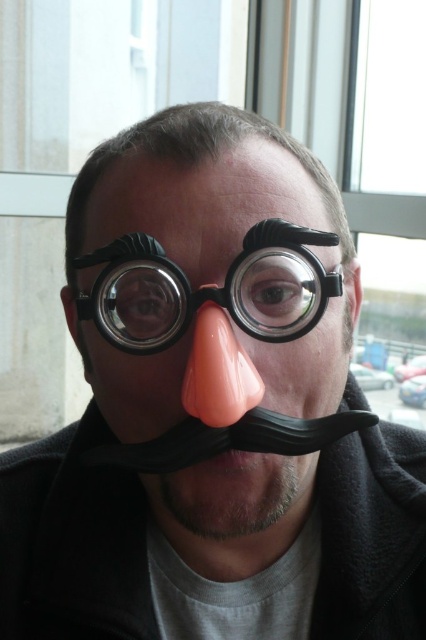
Does rubber/matte clown nose at center appear over black rubber mustache at lower center?

Indeed, rubber/matte clown nose at center is positioned over black rubber mustache at lower center.

Describe the element at coordinates (218, 371) in the screenshot. I see `rubber/matte clown nose at center` at that location.

Does point (247, 141) come behind point (198, 460)?

Yes, point (247, 141) is behind point (198, 460).

The height and width of the screenshot is (640, 426). I want to click on rubber/matte clown nose at center, so click(x=218, y=371).

Is pink rubber nose at center bigger than black rubber mustache at lower center?

Correct, pink rubber nose at center is larger in size than black rubber mustache at lower center.

Where is `pink rubber nose at center`? Image resolution: width=426 pixels, height=640 pixels. pink rubber nose at center is located at coordinates (218, 371).

Does point (253, 364) come behind point (253, 451)?

Yes, point (253, 364) is farther from viewer.

This screenshot has height=640, width=426. I want to click on pink rubber nose at center, so (218, 371).

Which is in front, point (328, 244) or point (186, 406)?

Point (186, 406) is more forward.

Does black plastic goggles at center appear over pink rubber nose at center?

Yes, black plastic goggles at center is above pink rubber nose at center.

Where is `black plastic goggles at center`? The image size is (426, 640). black plastic goggles at center is located at coordinates (210, 289).